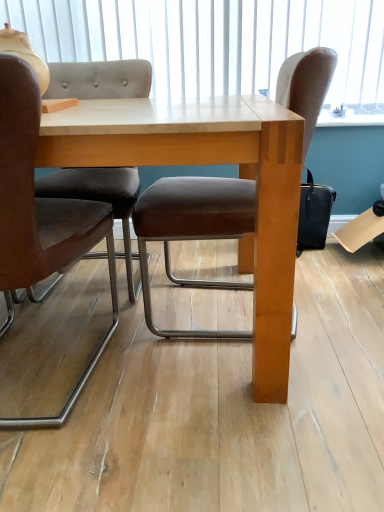
Question: Are brown leather chair at left, positioned as the second chair in right-to-left order, and white matte window screen at upper center beside each other?

Choices:
 (A) yes
 (B) no

Answer: (B)

Question: Does brown leather chair at left, positioned as the second chair in right-to-left order, have a larger size compared to white matte window screen at upper center?

Choices:
 (A) no
 (B) yes

Answer: (B)

Question: Is brown leather chair at left, arranged as the first chair when viewed from the left, smaller than white matte window screen at upper center?

Choices:
 (A) yes
 (B) no

Answer: (B)

Question: Is brown leather chair at left, positioned as the second chair in right-to-left order, taller than white matte window screen at upper center?

Choices:
 (A) no
 (B) yes

Answer: (B)

Question: From the image's perspective, would you say brown leather chair at left, arranged as the first chair when viewed from the left, is positioned over white matte window screen at upper center?

Choices:
 (A) yes
 (B) no

Answer: (B)

Question: Considering the relative positions of brown leather chair at left, positioned as the second chair in right-to-left order, and white matte window screen at upper center in the image provided, is brown leather chair at left, positioned as the second chair in right-to-left order, in front of white matte window screen at upper center?

Choices:
 (A) no
 (B) yes

Answer: (B)

Question: Does light wood table at center have a greater width compared to brown leather chair at left, positioned as the second chair in right-to-left order?

Choices:
 (A) no
 (B) yes

Answer: (B)

Question: Is brown leather chair at left, positioned as the second chair in right-to-left order, a part of light wood table at center?

Choices:
 (A) no
 (B) yes

Answer: (B)

Question: Is the depth of light wood table at center greater than that of brown leather chair at left, positioned as the second chair in right-to-left order?

Choices:
 (A) yes
 (B) no

Answer: (A)

Question: Considering the relative sizes of light wood table at center and brown leather chair at left, arranged as the first chair when viewed from the left, in the image provided, is light wood table at center smaller than brown leather chair at left, arranged as the first chair when viewed from the left,?

Choices:
 (A) yes
 (B) no

Answer: (B)

Question: Considering the relative positions of light wood table at center and brown leather chair at left, arranged as the first chair when viewed from the left, in the image provided, is light wood table at center to the right of brown leather chair at left, arranged as the first chair when viewed from the left, from the viewer's perspective?

Choices:
 (A) no
 (B) yes

Answer: (B)

Question: From the image's perspective, does light wood table at center appear higher than brown leather chair at left, arranged as the first chair when viewed from the left?

Choices:
 (A) yes
 (B) no

Answer: (A)

Question: Considering the relative sizes of white matte window screen at upper center and brown leather chair at left, arranged as the first chair when viewed from the left, in the image provided, is white matte window screen at upper center thinner than brown leather chair at left, arranged as the first chair when viewed from the left,?

Choices:
 (A) no
 (B) yes

Answer: (B)